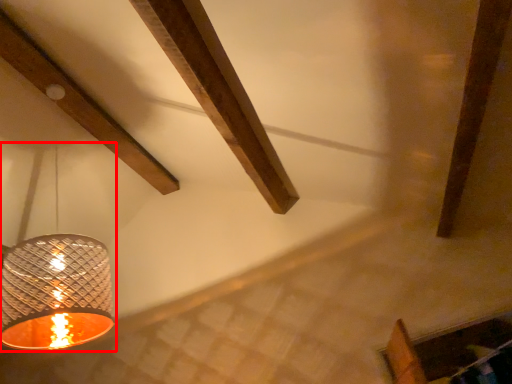
Question: From the image's perspective, considering the relative positions of lamp (annotated by the red box) and plank in the image provided, where is lamp (annotated by the red box) located with respect to the staircase?

Choices:
 (A) above
 (B) below

Answer: (B)